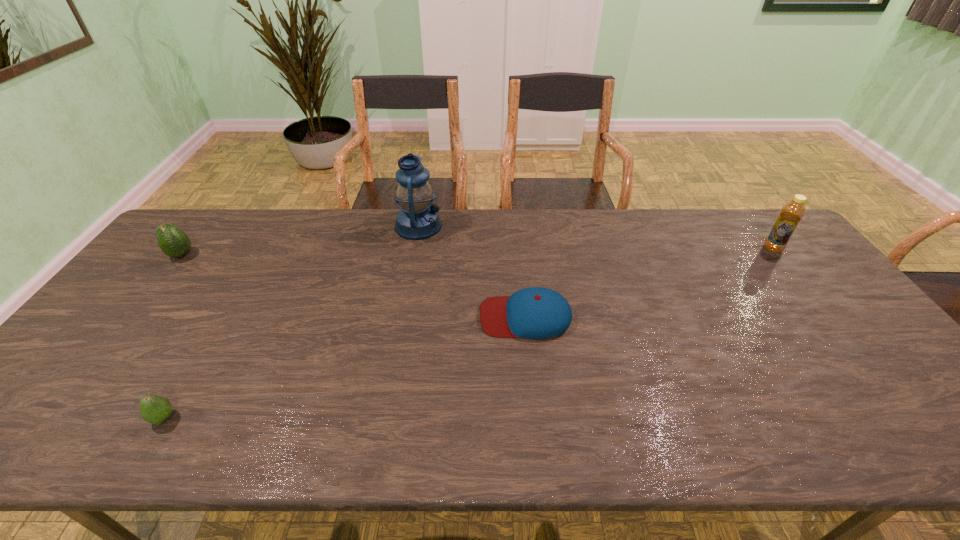
Identify the location of vacant space situated on the face of the third object from right to left. (523, 226).

In order to click on vacant space situated 0.170m on the front of the second tallest object in this screenshot , I will do `click(806, 292)`.

This screenshot has width=960, height=540. I want to click on vacant space positioned 0.070m on the front of the left avocado, so click(x=163, y=279).

At what (x,y) coordinates should I click in order to perform the action: click on vacant point located on the back of the shorter avocado. Please return your answer as a coordinate pair (x, y). The image size is (960, 540). Looking at the image, I should click on (200, 357).

Locate an element on the screen. The height and width of the screenshot is (540, 960). vacant space located with the bill of the fourth farthest object facing forward is located at coordinates (407, 316).

At what (x,y) coordinates should I click in order to perform the action: click on free space located 0.190m with the bill of the fourth farthest object facing forward. Please return your answer as a coordinate pair (x, y). The width and height of the screenshot is (960, 540). Looking at the image, I should click on (410, 316).

Locate an element on the screen. vacant space situated with the bill of the fourth farthest object facing forward is located at coordinates (414, 316).

Image resolution: width=960 pixels, height=540 pixels. What are the coordinates of `lantern that is at the far edge` in the screenshot? It's located at (418, 219).

Identify the location of bottle at the far edge. (792, 212).

At what (x,y) coordinates should I click in order to perform the action: click on avocado present at the far edge. Please return your answer as a coordinate pair (x, y). Looking at the image, I should click on (172, 241).